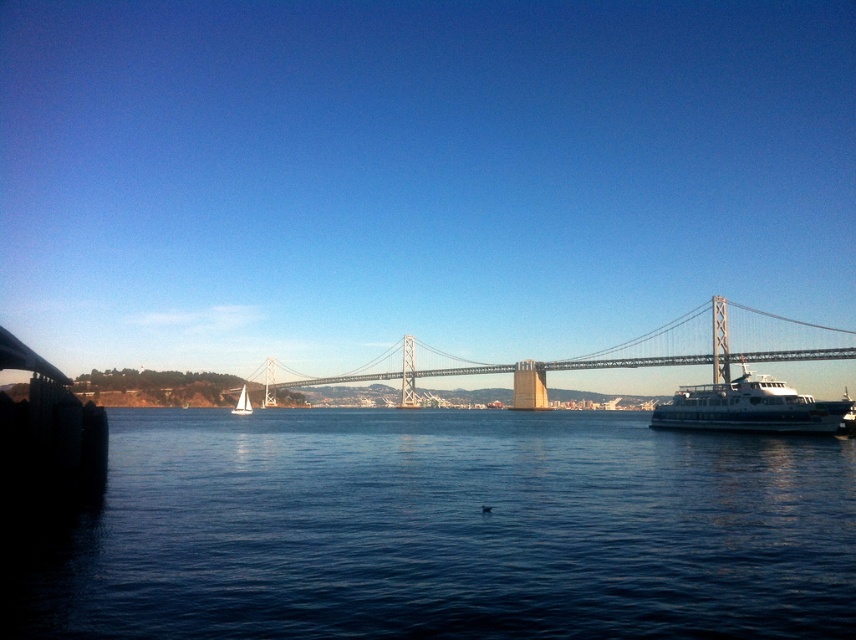
You are standing on the dock and see the blue water at lower center and the metallic gray suspension bridge at center. Which object is closer to your left side?

The blue water at lower center is positioned on the left side of the metallic gray suspension bridge at center, so it is closer to your left side.

You are an architect evaluating the spatial compatibility of the metallic gray suspension bridge at center and the white sailboat at left in the waterfront scene. Based on their widths, can the sailboat pass under the bridge without any adjustments?

The metallic gray suspension bridge at center is wider than the white sailboat at left, so the sailboat can pass under the bridge without any adjustments as the bridge provides sufficient width.

You are a drone operator tasked with capturing aerial footage of the waterfront scene. The drone is currently positioned at point A, which is at coordinates 0.3, 0.7. You need to fly the drone to the metallic gray suspension bridge at center to get a close shot. In which direction should you direct the drone to move from its current position to reach the bridge?

The metallic gray suspension bridge at center is located at point (694,353). Since the drone is at (598,192), it should move northeast to reach the bridge.